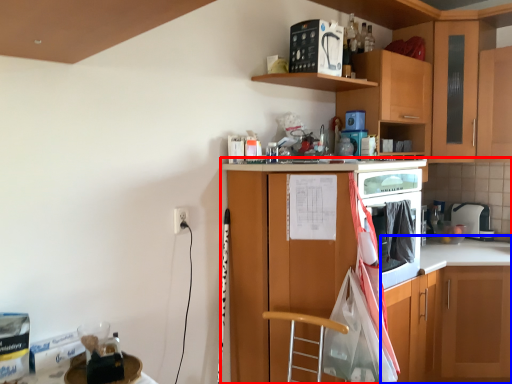
Question: Which object is closer to the camera taking this photo, cabinetry (highlighted by a red box) or counter (highlighted by a blue box)?

Choices:
 (A) cabinetry
 (B) counter

Answer: (A)